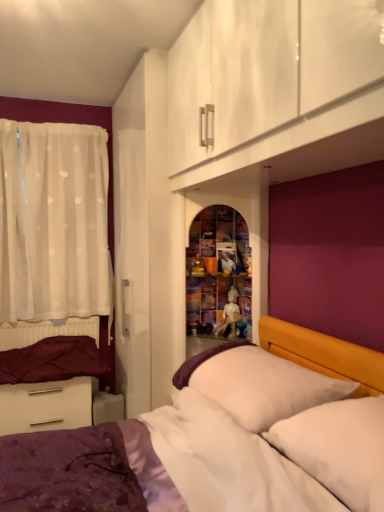
Where is `vacant point above white sheer curtain at left (from a real-world perspective)`? vacant point above white sheer curtain at left (from a real-world perspective) is located at coordinates click(x=45, y=122).